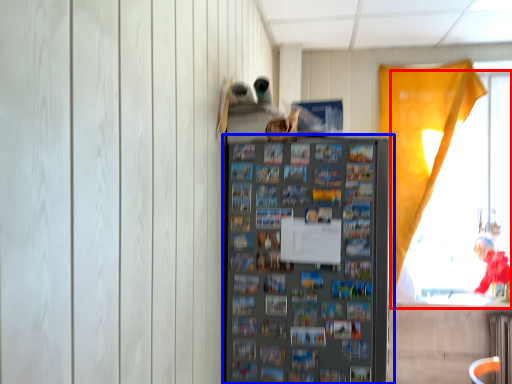
Question: Which object appears closest to the camera in this image, window (highlighted by a red box) or shelf (highlighted by a blue box)?

Choices:
 (A) window
 (B) shelf

Answer: (B)